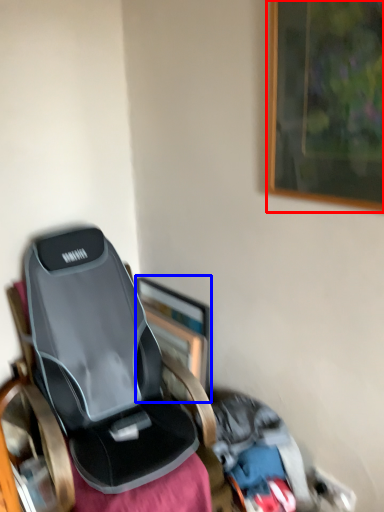
Question: Which object appears farthest to the camera in this image, picture frame (highlighted by a red box) or picture frame (highlighted by a blue box)?

Choices:
 (A) picture frame
 (B) picture frame

Answer: (B)